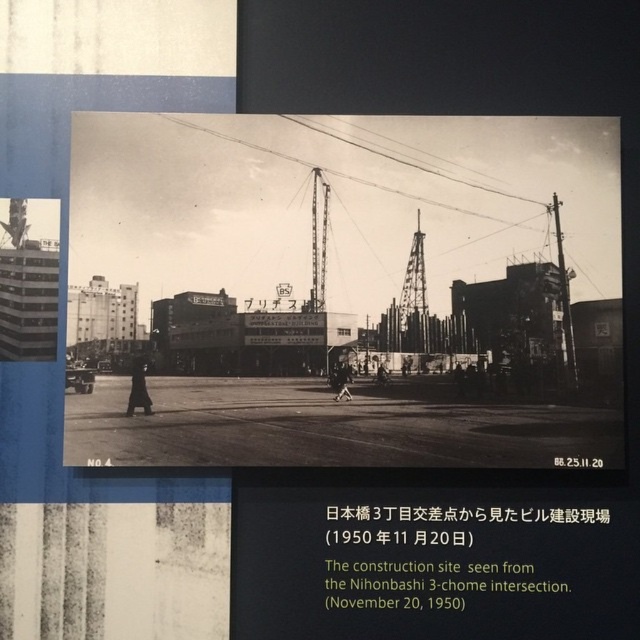
Does metallic tower at center have a greater width compared to metallic construction crane at center?

Correct, the width of metallic tower at center exceeds that of metallic construction crane at center.

Locate an element on the screen. The height and width of the screenshot is (640, 640). metallic tower at center is located at coordinates (413, 298).